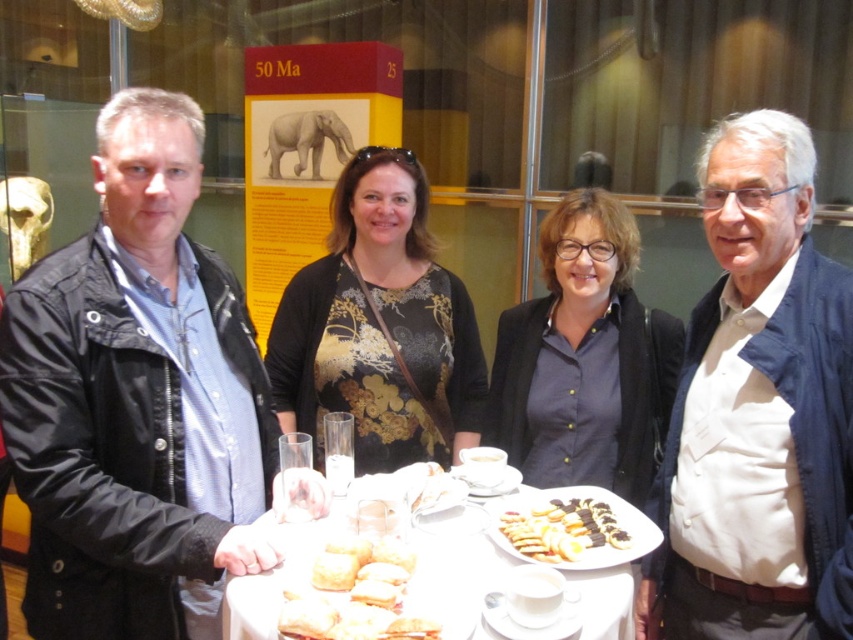
You are at a bakery and want to choose between the golden brown flaky pastry at center and the golden brown cookie at center. Which one is taller?

The golden brown flaky pastry at center is taller than the golden brown cookie at center.

You are a food delivery robot with a 10 cm wide tray. You need to place a cookie on the white porcelain plate at center. Can you fit the golden brown cookie at center onto the plate without moving either object?

The distance between the white porcelain plate at center and the golden brown cookie at center is 12.94 centimeters. Since your tray is 10 cm wide, there isn not enough space to place the cookie on the plate without moving them.